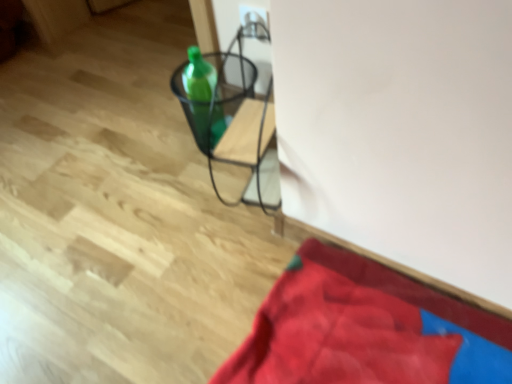
This screenshot has height=384, width=512. I want to click on velvety red blanket at lower right, so click(x=365, y=329).

At what (x,y) coordinates should I click in order to perform the action: click on green glass bottle at center. Please return your answer as a coordinate pair (x, y). The image size is (512, 384). Looking at the image, I should click on (203, 97).

Locate an element on the screen. The width and height of the screenshot is (512, 384). velvety red blanket at lower right is located at coordinates pyautogui.click(x=365, y=329).

The width and height of the screenshot is (512, 384). Identify the location of furniture that appears below the green glass bottle at center (from the image's perspective). (226, 123).

Would you consider green glass bottle at center to be distant from metallic wire basket at center?

That's not correct — green glass bottle at center is a little close to metallic wire basket at center.

How different are the orientations of green glass bottle at center and metallic wire basket at center in degrees?

green glass bottle at center and metallic wire basket at center are facing 8.03e-05 degrees away from each other.

Considering the sizes of green glass bottle at center and velvety red blanket at lower right in the image, is green glass bottle at center taller or shorter than velvety red blanket at lower right?

green glass bottle at center is taller than velvety red blanket at lower right.

Considering the relative sizes of green glass bottle at center and velvety red blanket at lower right in the image provided, is green glass bottle at center smaller than velvety red blanket at lower right?

Yes, green glass bottle at center is smaller than velvety red blanket at lower right.

Which is behind, green glass bottle at center or velvety red blanket at lower right?

green glass bottle at center.

From the image's perspective, which one is positioned lower, velvety red blanket at lower right or green glass bottle at center?

velvety red blanket at lower right is shown below in the image.

Who is bigger, velvety red blanket at lower right or green glass bottle at center?

velvety red blanket at lower right.

Is velvety red blanket at lower right positioned beyond the bounds of green glass bottle at center?

Yes.

In the scene shown: From a real-world perspective, which is physically below, velvety red blanket at lower right or green glass bottle at center?

From a 3D spatial view, velvety red blanket at lower right is below.

Is metallic wire basket at center bigger than velvety red blanket at lower right?

No, metallic wire basket at center is not bigger than velvety red blanket at lower right.

Which is farther from the camera, (227, 136) or (448, 300)?

Positioned behind is point (227, 136).

Is metallic wire basket at center wider or thinner than velvety red blanket at lower right?

Clearly, metallic wire basket at center has less width compared to velvety red blanket at lower right.

Which object is further away from the camera taking this photo, metallic wire basket at center or velvety red blanket at lower right?

metallic wire basket at center is further from the camera.

Considering the sizes of objects velvety red blanket at lower right and metallic wire basket at center in the image provided, who is taller, velvety red blanket at lower right or metallic wire basket at center?

metallic wire basket at center is taller.

From a real-world perspective, between velvety red blanket at lower right and metallic wire basket at center, who is vertically lower?

velvety red blanket at lower right, from a real-world perspective.

Is velvety red blanket at lower right oriented towards metallic wire basket at center?

Yes.

This screenshot has height=384, width=512. In the image, there is a green glass bottle at center. Identify the location of furniture below it (from a real-world perspective). (226, 123).

Which is in front, point (221, 118) or point (208, 66)?

Positioned in front is point (221, 118).

Consider the image. Are metallic wire basket at center and green glass bottle at center making contact?

Yes, metallic wire basket at center is next to green glass bottle at center.

In the image, there is a green glass bottle at center. At what (x,y) coordinates should I click in order to perform the action: click on furniture below it (from a real-world perspective). Please return your answer as a coordinate pair (x, y). The height and width of the screenshot is (384, 512). Looking at the image, I should click on (226, 123).

This screenshot has height=384, width=512. I want to click on bottle above the velvety red blanket at lower right (from a real-world perspective), so click(203, 97).

Based on their spatial positions, is velvety red blanket at lower right or green glass bottle at center closer to metallic wire basket at center?

green glass bottle at center is positioned closer to the anchor metallic wire basket at center.

Based on their spatial positions, is green glass bottle at center or metallic wire basket at center further from velvety red blanket at lower right?

A: green glass bottle at center.

Which object lies nearer to the anchor point green glass bottle at center, metallic wire basket at center or velvety red blanket at lower right?

metallic wire basket at center is closer to green glass bottle at center.

Based on their spatial positions, is velvety red blanket at lower right or metallic wire basket at center further from green glass bottle at center?

The object further to green glass bottle at center is velvety red blanket at lower right.

Based on their spatial positions, is metallic wire basket at center or green glass bottle at center closer to velvety red blanket at lower right?

metallic wire basket at center is positioned closer to the anchor velvety red blanket at lower right.

Based on their spatial positions, is green glass bottle at center or velvety red blanket at lower right closer to metallic wire basket at center?

green glass bottle at center is closer to metallic wire basket at center.

In order to click on furniture between green glass bottle at center and velvety red blanket at lower right in the up-down direction in this screenshot , I will do `click(226, 123)`.